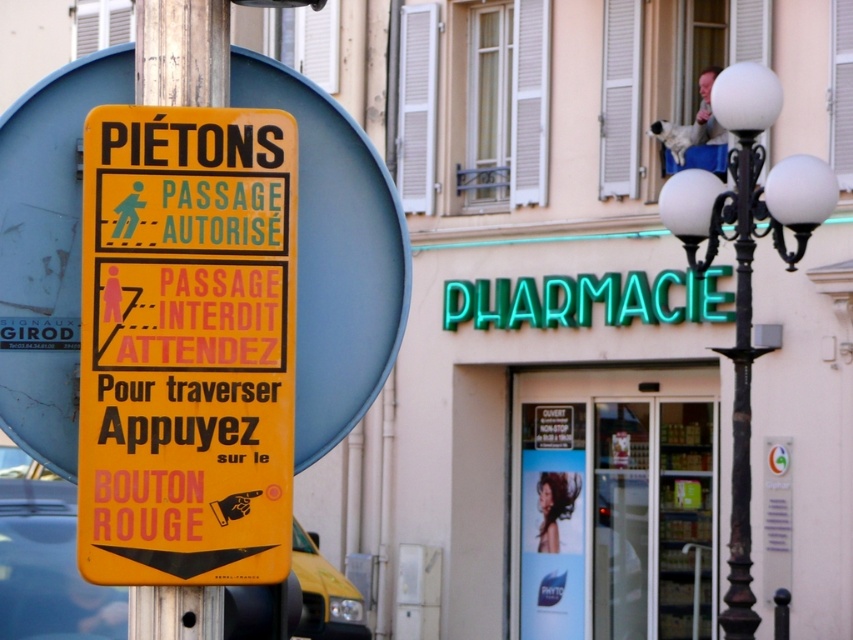
Question: Can you confirm if yellow plastic sign at left is wider than metallic parking sign at center?

Choices:
 (A) no
 (B) yes

Answer: (B)

Question: Which object appears farthest from the camera in this image?

Choices:
 (A) yellow plastic car at lower left
 (B) yellow matte sign at left

Answer: (A)

Question: Which object is the closest to the metallic pole at left?

Choices:
 (A) yellow plastic car at lower left
 (B) transparent glass door at center
 (C) yellow matte sign at left

Answer: (C)

Question: Can you confirm if yellow plastic sign at left is positioned above transparent glass door at center?

Choices:
 (A) yes
 (B) no

Answer: (A)

Question: Where is yellow plastic car at lower left located in relation to metallic pole at left in the image?

Choices:
 (A) below
 (B) above

Answer: (A)

Question: Among these points, which one is farthest from the camera?

Choices:
 (A) (193, 260)
 (B) (152, 632)

Answer: (B)